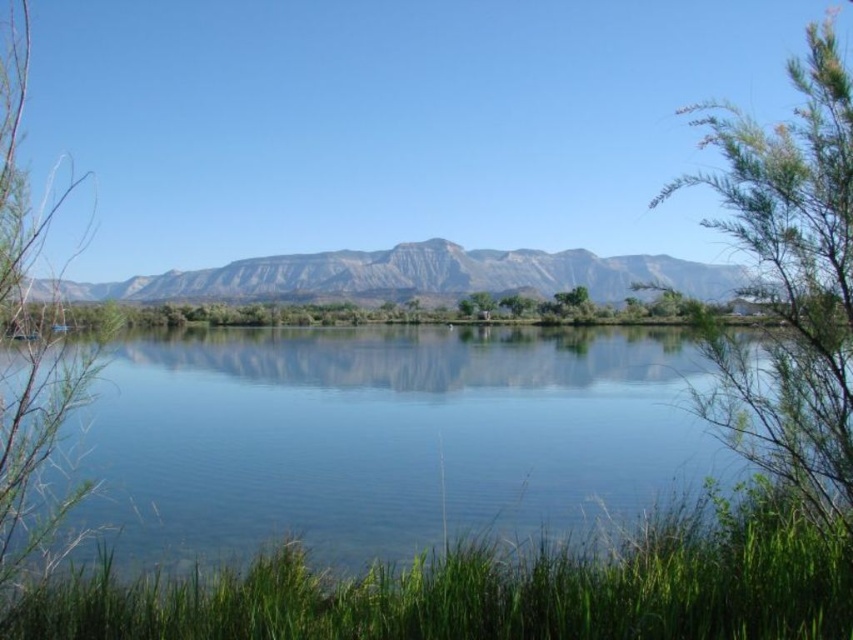
Between point (488, 372) and point (821, 548), which one is positioned behind?

Point (488, 372)

Measure the distance between point (427, 378) and camera.

Point (427, 378) and camera are 173.12 feet apart.

In order to click on clear water at center in this screenshot , I will do `click(381, 440)`.

In the scene shown: Does green leafy tree at left have a greater height compared to green leafy tree at center?

Yes.

Can you confirm if green leafy tree at left is positioned above green leafy tree at center?

No, green leafy tree at left is not above green leafy tree at center.

Measure the distance between point (24, 545) and camera.

Point (24, 545) is 8.46 meters away from camera.

Locate an element on the screen. The height and width of the screenshot is (640, 853). green leafy tree at left is located at coordinates (28, 344).

Between green grass at lower center and green leafy bush at right, which one has more height?

green leafy bush at right is taller.

Between green grass at lower center and green leafy bush at right, which one has less height?

green grass at lower center is shorter.

Does point (802, 636) come farther from viewer compared to point (720, 147)?

That is False.

Find the location of `green grass at lower center`. green grass at lower center is located at coordinates (495, 589).